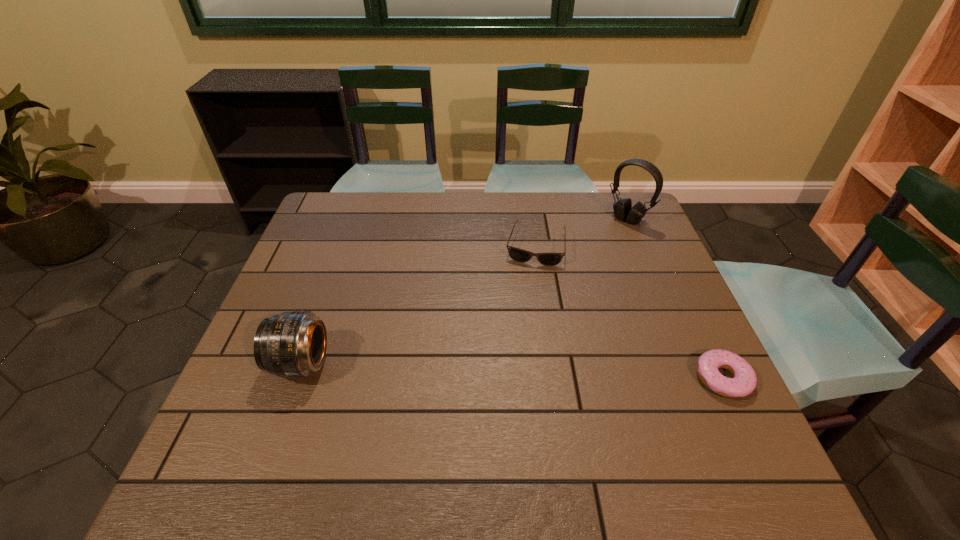
You are a GUI agent. You are given a task and a screenshot of the screen. Output one action in this format:
    pyautogui.click(x=<x>, y=<y>)
    Task: Click on the object that is the third closest to the doughnut
    The image size is (960, 540).
    Given the screenshot: What is the action you would take?
    tap(292, 344)

Where is `free space that satisfies the following two spatial constraints: 1. on the back side of the second shortest object; 2. on the left side of the headset`? Image resolution: width=960 pixels, height=540 pixels. free space that satisfies the following two spatial constraints: 1. on the back side of the second shortest object; 2. on the left side of the headset is located at coordinates [531, 219].